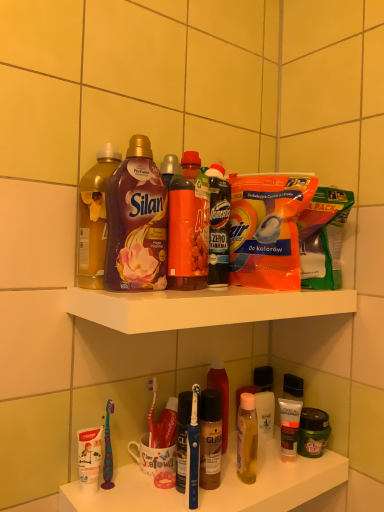
Where is `free space to the left of matte black hair mask at lower right, which is the first toiletry from front to back`? This screenshot has width=384, height=512. free space to the left of matte black hair mask at lower right, which is the first toiletry from front to back is located at coordinates (259, 464).